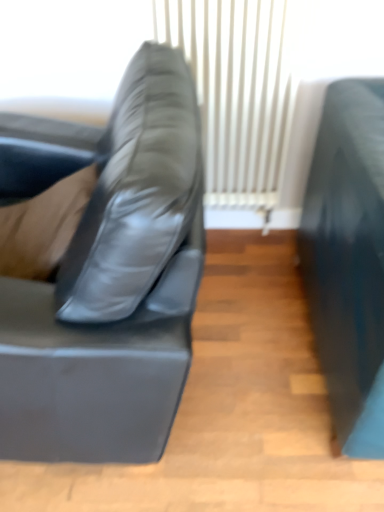
Question: Does white matte curtain at center lie in front of matte black couch at left?

Choices:
 (A) no
 (B) yes

Answer: (A)

Question: From the image's perspective, does white matte curtain at center appear lower than matte black couch at left?

Choices:
 (A) no
 (B) yes

Answer: (A)

Question: Is white matte curtain at center to the right of matte black couch at left from the viewer's perspective?

Choices:
 (A) yes
 (B) no

Answer: (A)

Question: From a real-world perspective, is white matte curtain at center physically below matte black couch at left?

Choices:
 (A) yes
 (B) no

Answer: (B)

Question: Does white matte curtain at center have a lesser height compared to matte black couch at left?

Choices:
 (A) yes
 (B) no

Answer: (B)

Question: Does white matte curtain at center have a smaller size compared to matte black couch at left?

Choices:
 (A) no
 (B) yes

Answer: (B)

Question: Can you confirm if matte black couch at left is positioned to the left of white matte curtain at center?

Choices:
 (A) no
 (B) yes

Answer: (B)

Question: From the image's perspective, would you say matte black couch at left is shown under white matte curtain at center?

Choices:
 (A) yes
 (B) no

Answer: (A)

Question: Does matte black couch at left have a smaller size compared to white matte curtain at center?

Choices:
 (A) yes
 (B) no

Answer: (B)

Question: Can you confirm if matte black couch at left is shorter than white matte curtain at center?

Choices:
 (A) no
 (B) yes

Answer: (B)

Question: Is matte black couch at left further to camera compared to white matte curtain at center?

Choices:
 (A) yes
 (B) no

Answer: (B)

Question: Can white matte curtain at center be found inside matte black couch at left?

Choices:
 (A) no
 (B) yes

Answer: (A)

Question: Is matte black couch at left bigger or smaller than white matte curtain at center?

Choices:
 (A) big
 (B) small

Answer: (A)